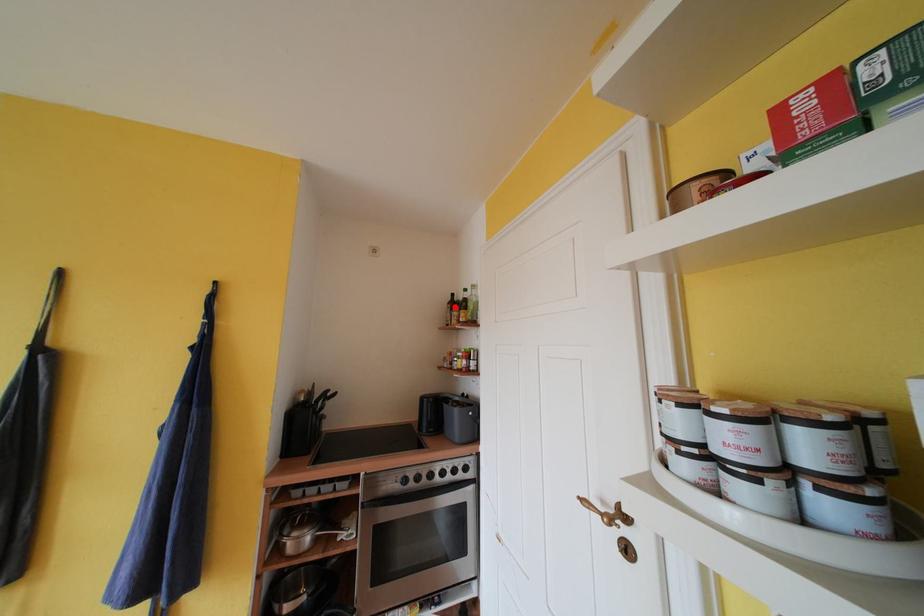
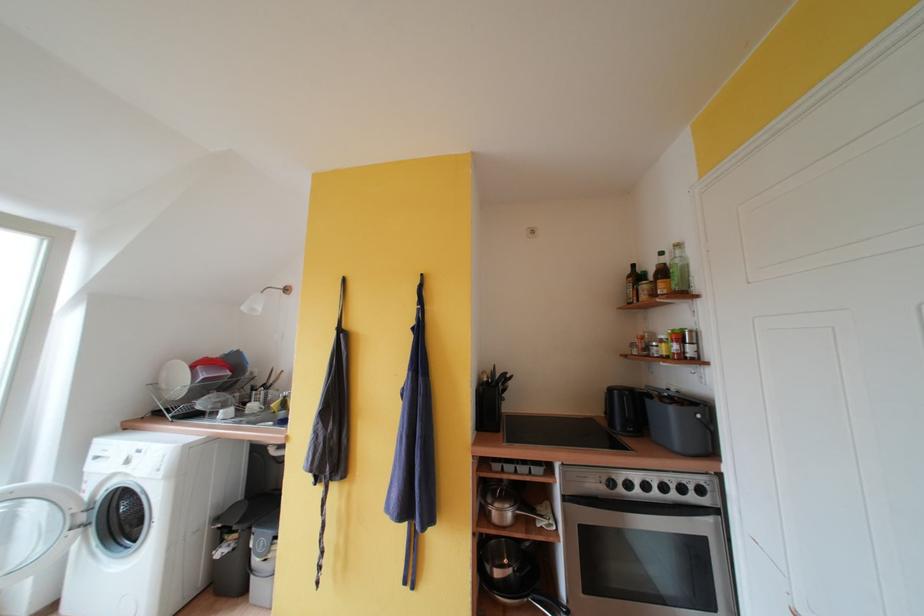
Find the pixel in the second image that matches the highlighted location in the first image.

(634, 281)